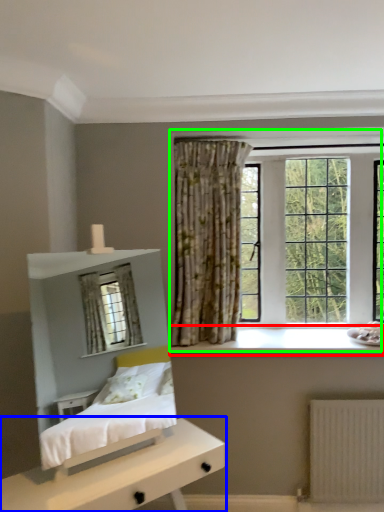
Question: Which object is the farthest from window sill (highlighted by a red box)? Choose among these: nightstand (highlighted by a blue box) or window (highlighted by a green box).

Choices:
 (A) nightstand
 (B) window

Answer: (A)